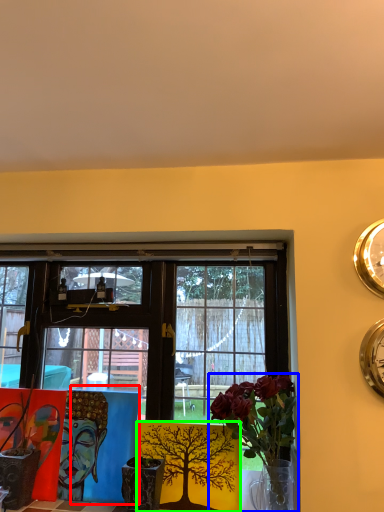
Question: Estimate the real-world distances between objects in this image. Which object is farther from table (highlighted by a red box), houseplant (highlighted by a blue box) or floral arrangement (highlighted by a green box)?

Choices:
 (A) houseplant
 (B) floral arrangement

Answer: (A)